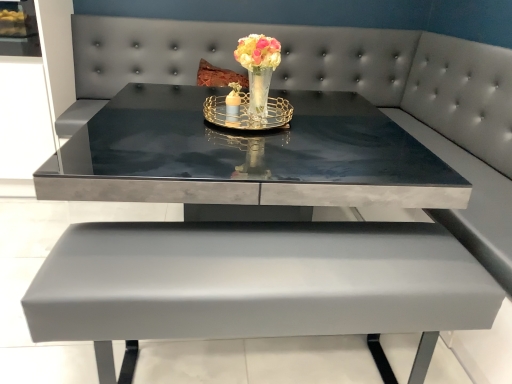
Question: Is glossy glass vase at center facing towards glossy concrete table at center?

Choices:
 (A) no
 (B) yes

Answer: (A)

Question: Does glossy glass vase at center have a larger size compared to glossy concrete table at center?

Choices:
 (A) no
 (B) yes

Answer: (A)

Question: Can you confirm if glossy glass vase at center is positioned to the left of glossy concrete table at center?

Choices:
 (A) yes
 (B) no

Answer: (B)

Question: Are glossy glass vase at center and glossy concrete table at center making contact?

Choices:
 (A) no
 (B) yes

Answer: (A)

Question: From a real-world perspective, is glossy glass vase at center physically below glossy concrete table at center?

Choices:
 (A) no
 (B) yes

Answer: (A)

Question: Considering their positions, is glossy glass vase at center located in front of or behind glossy concrete table at center?

Choices:
 (A) front
 (B) behind

Answer: (B)

Question: Is point (253, 46) closer or farther from the camera than point (33, 311)?

Choices:
 (A) farther
 (B) closer

Answer: (A)

Question: From their relative heights in the image, would you say glossy glass vase at center is taller or shorter than glossy concrete table at center?

Choices:
 (A) tall
 (B) short

Answer: (B)

Question: Looking at their shapes, would you say glossy glass vase at center is wider or thinner than glossy concrete table at center?

Choices:
 (A) wide
 (B) thin

Answer: (B)

Question: In terms of width, does glossy concrete table at center look wider or thinner when compared to gold metallic tray at center?

Choices:
 (A) wide
 (B) thin

Answer: (A)

Question: From a real-world perspective, is glossy concrete table at center positioned above or below gold metallic tray at center?

Choices:
 (A) above
 (B) below

Answer: (B)

Question: Is glossy concrete table at center inside the boundaries of gold metallic tray at center, or outside?

Choices:
 (A) inside
 (B) outside

Answer: (B)

Question: Is point (92, 160) positioned closer to the camera than point (246, 104)?

Choices:
 (A) closer
 (B) farther

Answer: (B)

Question: Considering the positions of gold metallic tray at center and glossy concrete table at center in the image, is gold metallic tray at center taller or shorter than glossy concrete table at center?

Choices:
 (A) tall
 (B) short

Answer: (B)

Question: Is point (210, 107) positioned closer to the camera than point (48, 283)?

Choices:
 (A) farther
 (B) closer

Answer: (A)